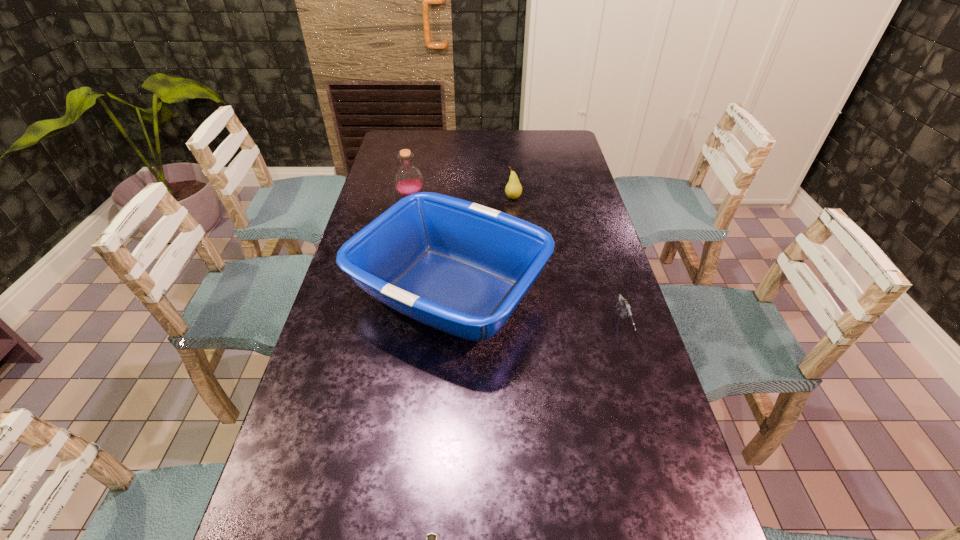
The width and height of the screenshot is (960, 540). Find the location of `bottle`. bottle is located at coordinates (408, 179).

The width and height of the screenshot is (960, 540). Find the location of `tray`. tray is located at coordinates (460, 267).

This screenshot has width=960, height=540. What are the coordinates of `pear` in the screenshot? It's located at (513, 189).

Locate an element on the screen. the rightmost object is located at coordinates (623, 304).

This screenshot has height=540, width=960. What are the coordinates of `the farther gun` in the screenshot? It's located at (623, 304).

Where is `free spot located on the front of the bottle`? The height and width of the screenshot is (540, 960). free spot located on the front of the bottle is located at coordinates (402, 240).

Find the location of a particular element. This screenshot has width=960, height=540. vacant space situated 0.310m on the front of the tray is located at coordinates (435, 504).

Identify the location of free region located on the front of the pear. (520, 275).

This screenshot has height=540, width=960. I want to click on free location located 0.090m at the barrel of the right gun, so click(x=638, y=378).

Where is `bottle that is at the left edge`? The width and height of the screenshot is (960, 540). bottle that is at the left edge is located at coordinates (408, 179).